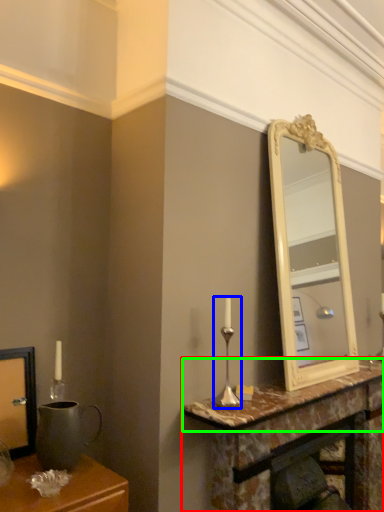
Question: Which is nearer to the table (highlighted by a red box)? candle holder (highlighted by a blue box) or counter top (highlighted by a green box).

Choices:
 (A) candle holder
 (B) counter top

Answer: (B)